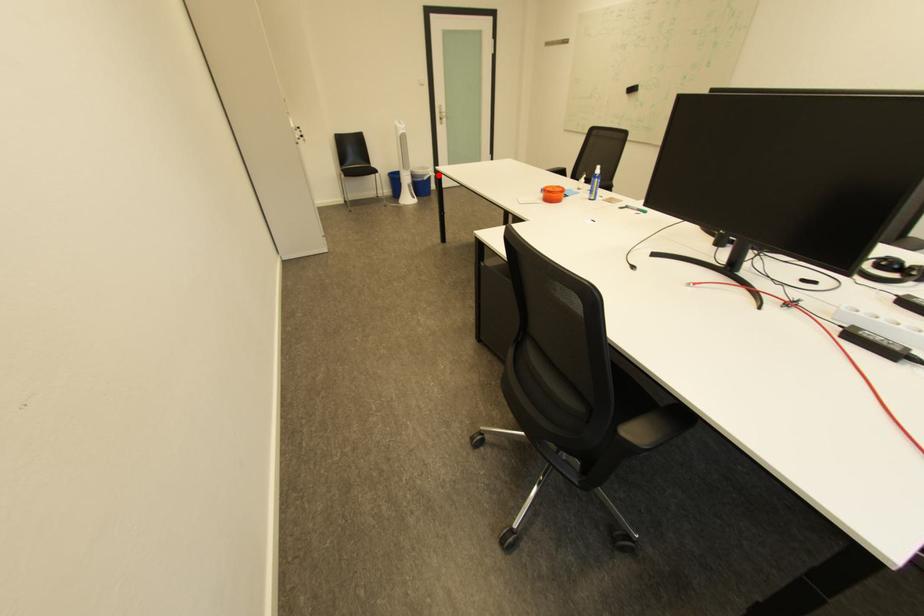
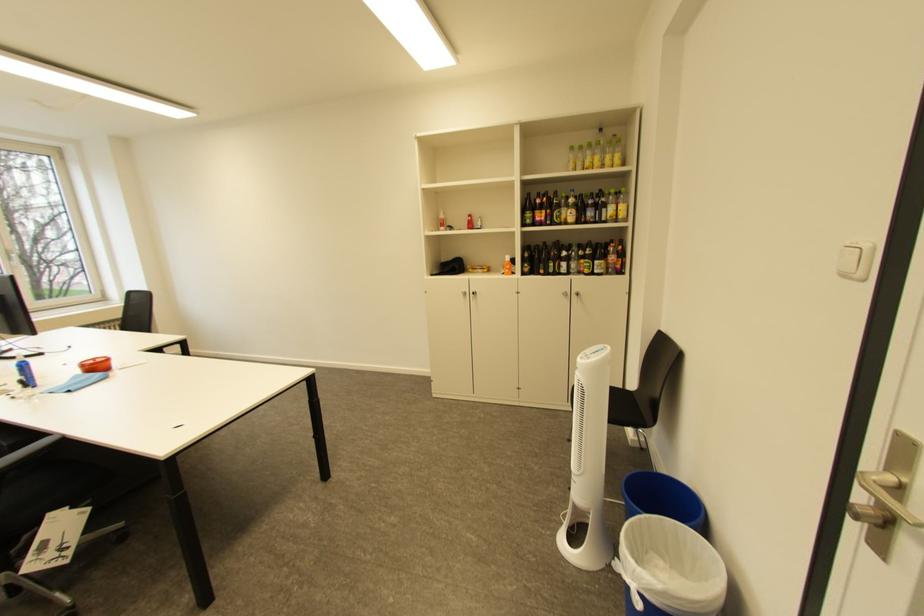
Question: I am providing you with two images of the same scene from different viewpoints. A red point is marked on the first image. At the location where the point appears in image 1, is it still visible in image 2?

Choices:
 (A) Yes
 (B) No

Answer: (A)